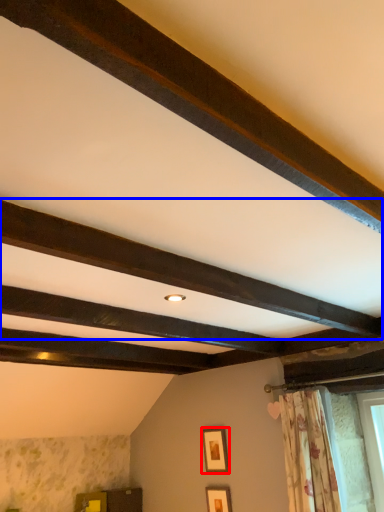
Question: Which object is further to the camera taking this photo, picture frame (highlighted by a red box) or plank (highlighted by a blue box)?

Choices:
 (A) picture frame
 (B) plank

Answer: (A)